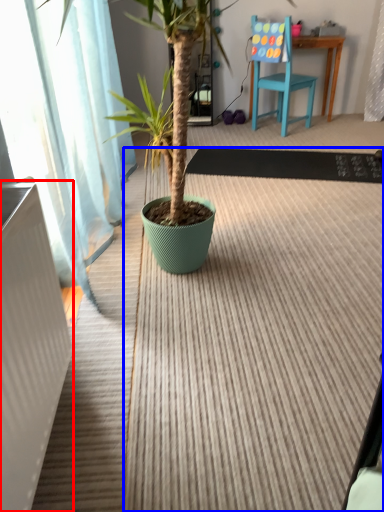
Question: Which of the following is the farthest to the observer, radiator (highlighted by a red box) or doormat (highlighted by a blue box)?

Choices:
 (A) radiator
 (B) doormat

Answer: (B)